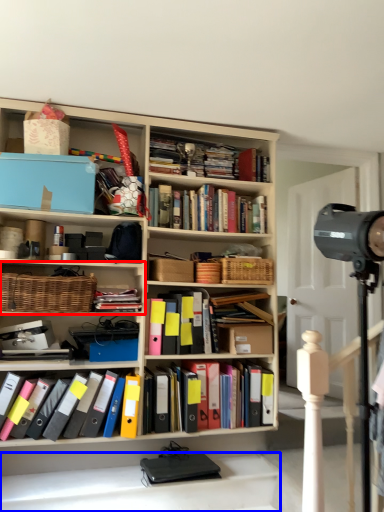
Question: Among these objects, which one is farthest to the camera, shelf (highlighted by a red box) or stairwell (highlighted by a blue box)?

Choices:
 (A) shelf
 (B) stairwell

Answer: (A)